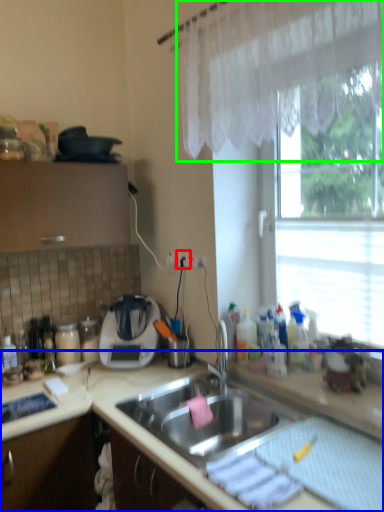
Question: Which object is positioned farthest from electric outlet (highlighted by a red box)? Select from countertop (highlighted by a blue box) and curtain (highlighted by a green box).

Choices:
 (A) countertop
 (B) curtain

Answer: (B)